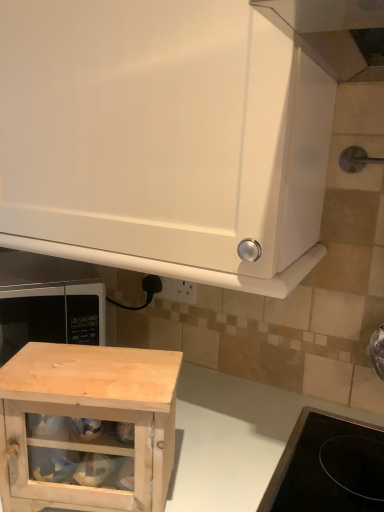
The image size is (384, 512). What do you see at coordinates (177, 290) in the screenshot?
I see `white plastic electric outlet at lower center` at bounding box center [177, 290].

Locate an element on the screen. The height and width of the screenshot is (512, 384). white glossy cabinet at upper center, acting as the 2th cabinetry starting from the bottom is located at coordinates (163, 140).

Image resolution: width=384 pixels, height=512 pixels. What are the coordinates of `natural wood cabinet at lower left, marked as the second cabinetry in a top-to-bottom arrangement` in the screenshot? It's located at (86, 426).

From the image's perspective, would you say white glossy cabinet at upper center, the first cabinetry from the top, is shown under black matte microwave at lower left?

No, from the image's perspective, white glossy cabinet at upper center, the first cabinetry from the top, is not beneath black matte microwave at lower left.

Is there a large distance between white glossy cabinet at upper center, the first cabinetry from the top, and black matte microwave at lower left?

No.

Starting from the white plastic electric outlet at lower center, which cabinetry is the 2nd one in front? Please provide its 2D coordinates.

[(163, 140)]

Between white plastic electric outlet at lower center and white glossy cabinet at upper center, acting as the 2th cabinetry starting from the bottom, which one has smaller width?

Thinner between the two is white plastic electric outlet at lower center.

Is white plastic electric outlet at lower center to the left or to the right of white glossy cabinet at upper center, the first cabinetry from the top, in the image?

Based on their positions, white plastic electric outlet at lower center is located to the right of white glossy cabinet at upper center, the first cabinetry from the top.

From a real-world perspective, is white plastic electric outlet at lower center physically located above or below white glossy cabinet at upper center, the first cabinetry from the top?

From a real-world perspective, white plastic electric outlet at lower center is physically below white glossy cabinet at upper center, the first cabinetry from the top.

Does point (115, 394) lie in front of point (13, 95)?

Yes, it is in front of point (13, 95).

In terms of height, does natural wood cabinet at lower center look taller or shorter compared to white glossy cabinet at upper center, the first cabinetry from the top?

Considering their sizes, natural wood cabinet at lower center has more height than white glossy cabinet at upper center, the first cabinetry from the top.

Would you consider natural wood cabinet at lower center to be distant from white glossy cabinet at upper center, acting as the 2th cabinetry starting from the bottom?

natural wood cabinet at lower center is near white glossy cabinet at upper center, acting as the 2th cabinetry starting from the bottom, not far away.

At what (x,y) coordinates should I click in order to perform the action: click on the 2nd cabinetry in front of the natural wood cabinet at lower center, starting your count from the anchor. Please return your answer as a coordinate pair (x, y). This screenshot has height=512, width=384. Looking at the image, I should click on (163, 140).

Does white glossy cabinet at upper center, acting as the 2th cabinetry starting from the bottom, have a smaller size compared to natural wood cabinet at lower center?

Indeed, white glossy cabinet at upper center, acting as the 2th cabinetry starting from the bottom, has a smaller size compared to natural wood cabinet at lower center.

Are white glossy cabinet at upper center, the first cabinetry from the top, and natural wood cabinet at lower center far apart?

That's not correct — white glossy cabinet at upper center, the first cabinetry from the top, is a little close to natural wood cabinet at lower center.

From a real-world perspective, is white glossy cabinet at upper center, acting as the 2th cabinetry starting from the bottom, physically located above or below natural wood cabinet at lower center?

white glossy cabinet at upper center, acting as the 2th cabinetry starting from the bottom, is situated higher than natural wood cabinet at lower center in the real world.

Is black matte microwave at lower left far away from natural wood cabinet at lower left, marked as the second cabinetry in a top-to-bottom arrangement?

No, black matte microwave at lower left is not far away from natural wood cabinet at lower left, marked as the second cabinetry in a top-to-bottom arrangement.

From the image's perspective, relative to natural wood cabinet at lower left, marked as the second cabinetry in a top-to-bottom arrangement, is black matte microwave at lower left above or below?

Based on their image positions, black matte microwave at lower left is located above natural wood cabinet at lower left, marked as the second cabinetry in a top-to-bottom arrangement.

From a real-world perspective, is black matte microwave at lower left on top of natural wood cabinet at lower left, marked as the second cabinetry in a top-to-bottom arrangement?

Yes.

Between black matte microwave at lower left and natural wood cabinet at lower left, marked as the second cabinetry in a top-to-bottom arrangement, which one has more height?

black matte microwave at lower left.

Consider the image. Which is closer, (64, 191) or (169, 285)?

Point (64, 191) is closer to the camera than point (169, 285).

Does white glossy cabinet at upper center, acting as the 2th cabinetry starting from the bottom, contain white plastic electric outlet at lower center?

Definitely not — white plastic electric outlet at lower center is not inside white glossy cabinet at upper center, acting as the 2th cabinetry starting from the bottom.

Measure the distance between white glossy cabinet at upper center, acting as the 2th cabinetry starting from the bottom, and white plastic electric outlet at lower center.

16.98 inches.

Would you consider white glossy cabinet at upper center, the first cabinetry from the top, to be distant from white plastic electric outlet at lower center?

They are positioned close to each other.

Which of these two, white plastic electric outlet at lower center or natural wood cabinet at lower center, is wider?

natural wood cabinet at lower center.

Does white plastic electric outlet at lower center have a lesser height compared to natural wood cabinet at lower center?

Indeed, white plastic electric outlet at lower center has a lesser height compared to natural wood cabinet at lower center.

Considering the relative sizes of white plastic electric outlet at lower center and natural wood cabinet at lower center in the image provided, is white plastic electric outlet at lower center bigger than natural wood cabinet at lower center?

No, white plastic electric outlet at lower center is not bigger than natural wood cabinet at lower center.

Who is more distant, white plastic electric outlet at lower center or natural wood cabinet at lower center?

Positioned behind is white plastic electric outlet at lower center.

You are a GUI agent. You are given a task and a screenshot of the screen. Output one action in this format:
    pyautogui.click(x=<x>, y=<y>)
    Task: Click on the 2nd cabinetry in front of the black matte microwave at lower left
    This screenshot has height=512, width=384.
    Given the screenshot: What is the action you would take?
    pyautogui.click(x=163, y=140)

Image resolution: width=384 pixels, height=512 pixels. I want to click on the 1st cabinetry to the left when counting from the white plastic electric outlet at lower center, so click(163, 140).

When comparing their distances from black matte microwave at lower left, does white plastic electric outlet at lower center or natural wood cabinet at lower center seem closer?

white plastic electric outlet at lower center is positioned closer to the anchor black matte microwave at lower left.

Considering their positions, is white plastic electric outlet at lower center positioned closer to natural wood cabinet at lower center than black matte microwave at lower left?

Based on the image, black matte microwave at lower left appears to be nearer to natural wood cabinet at lower center.

Looking at the image, which one is located further to white glossy cabinet at upper center, acting as the 2th cabinetry starting from the bottom, white plastic electric outlet at lower center or natural wood cabinet at lower center?

white plastic electric outlet at lower center is positioned further to the anchor white glossy cabinet at upper center, acting as the 2th cabinetry starting from the bottom.

Based on their spatial positions, is white glossy cabinet at upper center, acting as the 2th cabinetry starting from the bottom, or black matte microwave at lower left closer to white plastic electric outlet at lower center?

black matte microwave at lower left is closer to white plastic electric outlet at lower center.

Considering their positions, is white glossy cabinet at upper center, the first cabinetry from the top, positioned closer to natural wood cabinet at lower center than natural wood cabinet at lower left, marked as the second cabinetry in a top-to-bottom arrangement?

The object closer to natural wood cabinet at lower center is natural wood cabinet at lower left, marked as the second cabinetry in a top-to-bottom arrangement.

Estimate the real-world distances between objects in this image. Which object is closer to natural wood cabinet at lower center, black matte microwave at lower left or white plastic electric outlet at lower center?

black matte microwave at lower left is positioned closer to the anchor natural wood cabinet at lower center.

From the image, which object appears to be nearer to white plastic electric outlet at lower center, natural wood cabinet at lower center or black matte microwave at lower left?

The object closer to white plastic electric outlet at lower center is black matte microwave at lower left.

When comparing their distances from natural wood cabinet at lower left, which is counted as the first cabinetry, starting from the bottom, does natural wood cabinet at lower center or white glossy cabinet at upper center, the first cabinetry from the top, seem closer?

Among the two, natural wood cabinet at lower center is located nearer to natural wood cabinet at lower left, which is counted as the first cabinetry, starting from the bottom.

Where is `electric outlet between white glossy cabinet at upper center, acting as the 2th cabinetry starting from the bottom, and natural wood cabinet at lower center in the up-down direction`? The image size is (384, 512). electric outlet between white glossy cabinet at upper center, acting as the 2th cabinetry starting from the bottom, and natural wood cabinet at lower center in the up-down direction is located at coordinates (177, 290).

The image size is (384, 512). In order to click on cabinetry between black matte microwave at lower left and natural wood cabinet at lower center from top to bottom in this screenshot , I will do `click(86, 426)`.

Locate an element on the screen. This screenshot has width=384, height=512. microwave oven positioned between natural wood cabinet at lower left, which is counted as the first cabinetry, starting from the bottom, and white plastic electric outlet at lower center from near to far is located at coordinates (52, 315).

Identify the location of microwave oven that lies between white glossy cabinet at upper center, the first cabinetry from the top, and natural wood cabinet at lower center from top to bottom. (52, 315).